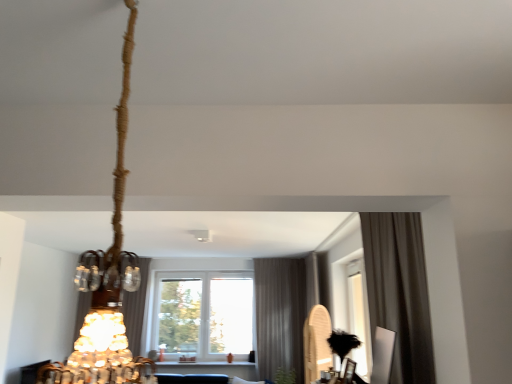
Question: Considering the positions of point (195, 344) and point (262, 374), is point (195, 344) closer or farther from the camera than point (262, 374)?

Choices:
 (A) closer
 (B) farther

Answer: (B)

Question: From the image's perspective, is transparent glass window at center positioned above or below gray textured curtain at center, which ranks as the 2th curtain in front-to-back order?

Choices:
 (A) above
 (B) below

Answer: (B)

Question: Considering the real-world distances, which object is closest to the gray textured curtain at center, positioned as the second curtain in right-to-left order?

Choices:
 (A) wooden paddle at right
 (B) brown fabric curtain at right, placed as the first curtain when sorted from right to left
 (C) satin brown curtain at center, placed as the first curtain when sorted from left to right
 (D) green leafy plant at lower center
 (E) braided rope chandelier at upper left

Answer: (D)

Question: Which object is positioned farthest from the green leafy plant at lower center?

Choices:
 (A) braided rope chandelier at upper left
 (B) transparent glass window at center
 (C) gray textured curtain at center, the 2th curtain when ordered from left to right
 (D) wooden paddle at right
 (E) satin brown curtain at center, placed as the first curtain when sorted from left to right

Answer: (A)